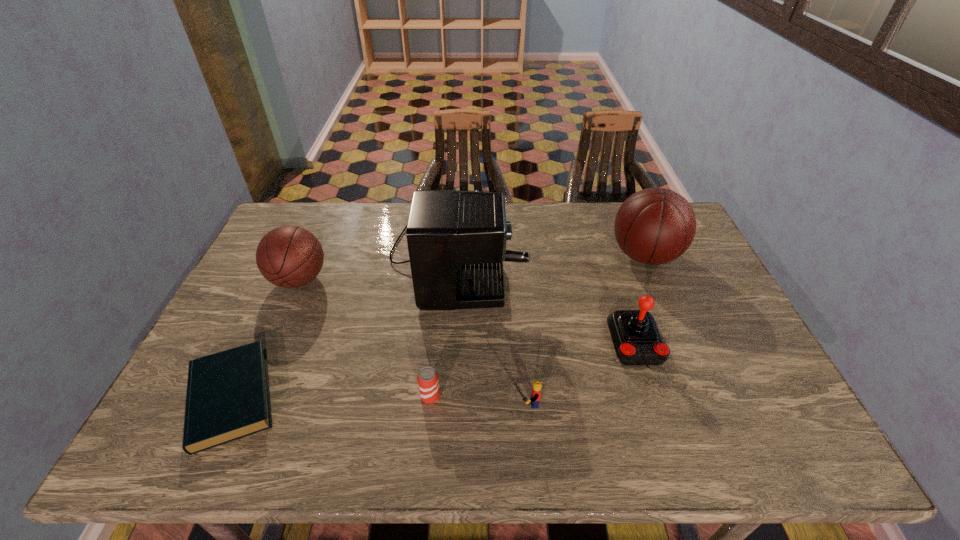
Find the location of a particular element. Image resolution: width=960 pixels, height=540 pixels. basketball that is positioned at the left edge is located at coordinates (288, 256).

You are a GUI agent. You are given a task and a screenshot of the screen. Output one action in this format:
    pyautogui.click(x=<x>, y=<y>)
    Task: Click on the book at the left edge
    The image size is (960, 540).
    Given the screenshot: What is the action you would take?
    pyautogui.click(x=228, y=398)

Identify the location of object present at the right edge. (654, 226).

This screenshot has height=540, width=960. What are the coordinates of `object at the near left corner` in the screenshot? It's located at (228, 398).

What are the coordinates of `object that is at the far right corner` in the screenshot? It's located at (654, 226).

The width and height of the screenshot is (960, 540). I want to click on free space at the far edge, so click(x=516, y=231).

Find the location of a particular element. The image size is (960, 540). vacant area at the near edge of the desktop is located at coordinates (696, 442).

Identify the location of free location at the left edge. This screenshot has height=540, width=960. (250, 308).

The height and width of the screenshot is (540, 960). In order to click on vacant area at the right edge in this screenshot , I will do `click(704, 276)`.

The width and height of the screenshot is (960, 540). What are the coordinates of `vacant space that is in between the coffee maker and the book` in the screenshot? It's located at (344, 326).